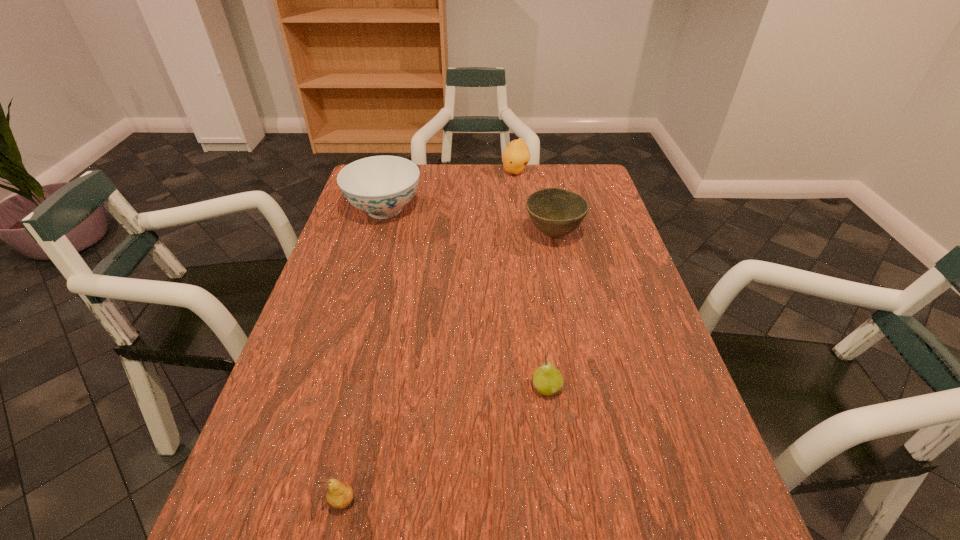
I want to click on the farthest object, so click(516, 155).

The width and height of the screenshot is (960, 540). Identify the location of the tallest pear. [516, 155].

Where is `chinaware`? This screenshot has width=960, height=540. chinaware is located at coordinates (381, 186).

At what (x,y) coordinates should I click in order to perform the action: click on bowl. Please return your answer as a coordinate pair (x, y). The height and width of the screenshot is (540, 960). Looking at the image, I should click on (556, 212).

You are a GUI agent. You are given a task and a screenshot of the screen. Output one action in this format:
    pyautogui.click(x=<x>, y=<y>)
    Task: Click on the second nearest object
    Image resolution: width=960 pixels, height=540 pixels.
    Given the screenshot: What is the action you would take?
    pyautogui.click(x=548, y=381)

The image size is (960, 540). What are the coordinates of `the leftmost pear` in the screenshot? It's located at (340, 495).

Locate an element on the screen. the nearest object is located at coordinates (340, 495).

Find the location of a particular element. free space located 0.100m on the right of the farthest object is located at coordinates (558, 172).

Image resolution: width=960 pixels, height=540 pixels. I want to click on vacant point located 0.070m on the right of the chinaware, so (445, 210).

This screenshot has width=960, height=540. Identify the location of vacant space located 0.220m on the back of the bowl. [x=542, y=181].